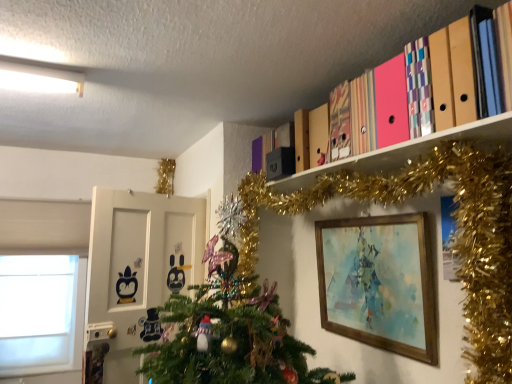
Question: Considering the relative sizes of wooden picture frame at lower right and green matte christmas tree at upper right in the image provided, is wooden picture frame at lower right taller than green matte christmas tree at upper right?

Choices:
 (A) no
 (B) yes

Answer: (A)

Question: Is wooden picture frame at lower right positioned before green matte christmas tree at upper right?

Choices:
 (A) no
 (B) yes

Answer: (A)

Question: Is wooden picture frame at lower right smaller than green matte christmas tree at upper right?

Choices:
 (A) yes
 (B) no

Answer: (A)

Question: From a real-world perspective, is wooden picture frame at lower right below green matte christmas tree at upper right?

Choices:
 (A) yes
 (B) no

Answer: (A)

Question: Considering the relative positions of wooden picture frame at lower right and green matte christmas tree at upper right in the image provided, is wooden picture frame at lower right to the right of green matte christmas tree at upper right from the viewer's perspective?

Choices:
 (A) no
 (B) yes

Answer: (B)

Question: From a real-world perspective, is wooden picture frame at lower right physically located above or below green matte christmas tree at upper right?

Choices:
 (A) below
 (B) above

Answer: (A)

Question: Is wooden picture frame at lower right spatially inside green matte christmas tree at upper right, or outside of it?

Choices:
 (A) inside
 (B) outside

Answer: (A)

Question: From the image's perspective, relative to green matte christmas tree at upper right, is wooden picture frame at lower right above or below?

Choices:
 (A) below
 (B) above

Answer: (A)

Question: Is wooden picture frame at lower right to the left or to the right of green matte christmas tree at upper right in the image?

Choices:
 (A) right
 (B) left

Answer: (A)

Question: From the image's perspective, is matte cardboard folders at upper right positioned above or below white matte window at left?

Choices:
 (A) below
 (B) above

Answer: (B)

Question: Is matte cardboard folders at upper right wider or thinner than white matte window at left?

Choices:
 (A) wide
 (B) thin

Answer: (A)

Question: In terms of height, does matte cardboard folders at upper right look taller or shorter compared to white matte window at left?

Choices:
 (A) short
 (B) tall

Answer: (A)

Question: From a real-world perspective, is matte cardboard folders at upper right above or below white matte window at left?

Choices:
 (A) below
 (B) above

Answer: (B)

Question: From the image's perspective, is green matte christmas tree at upper right located above or below matte cardboard folders at upper right?

Choices:
 (A) above
 (B) below

Answer: (B)

Question: Relative to matte cardboard folders at upper right, is green matte christmas tree at upper right in front or behind?

Choices:
 (A) behind
 (B) front

Answer: (B)